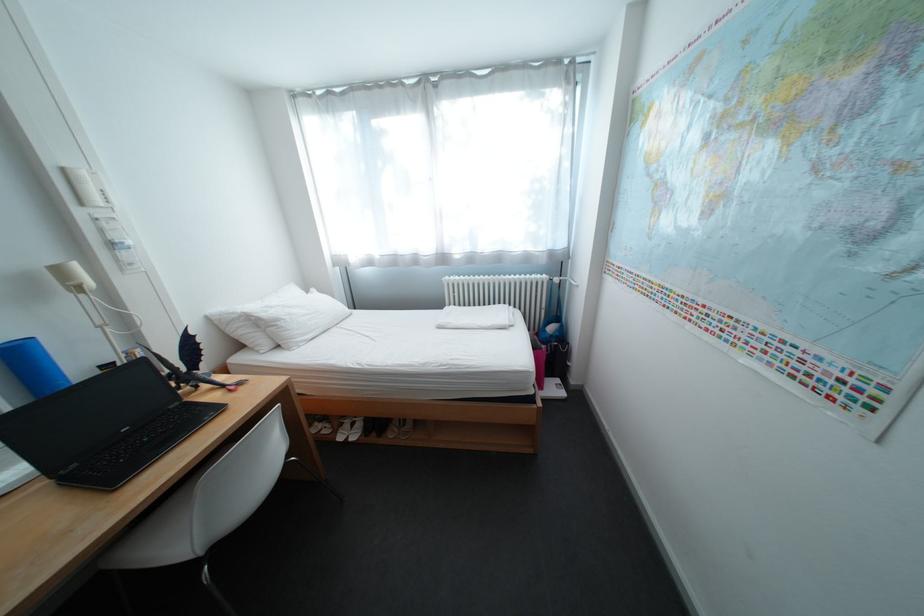
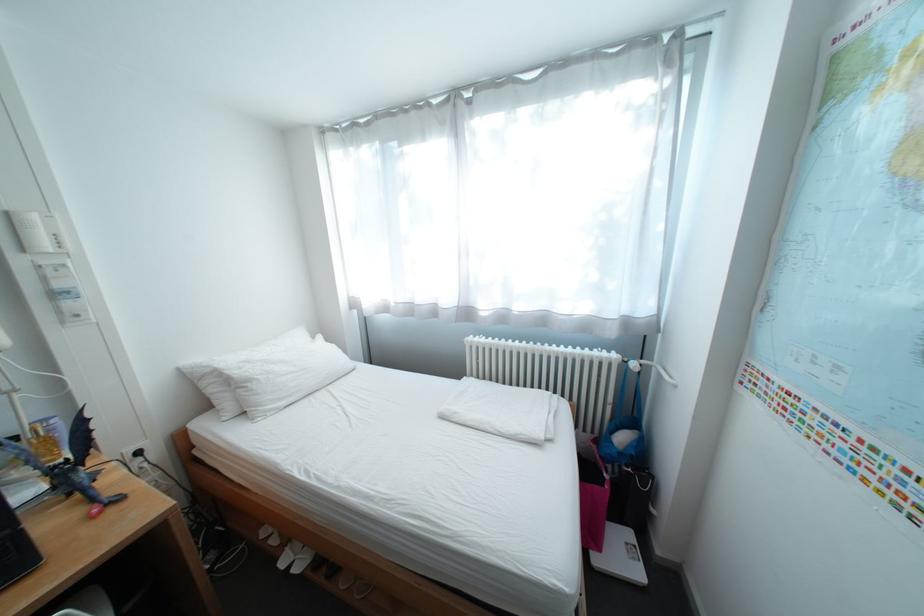
Find the pixel in the second image that matches (x=360, y=438) in the first image.

(307, 562)